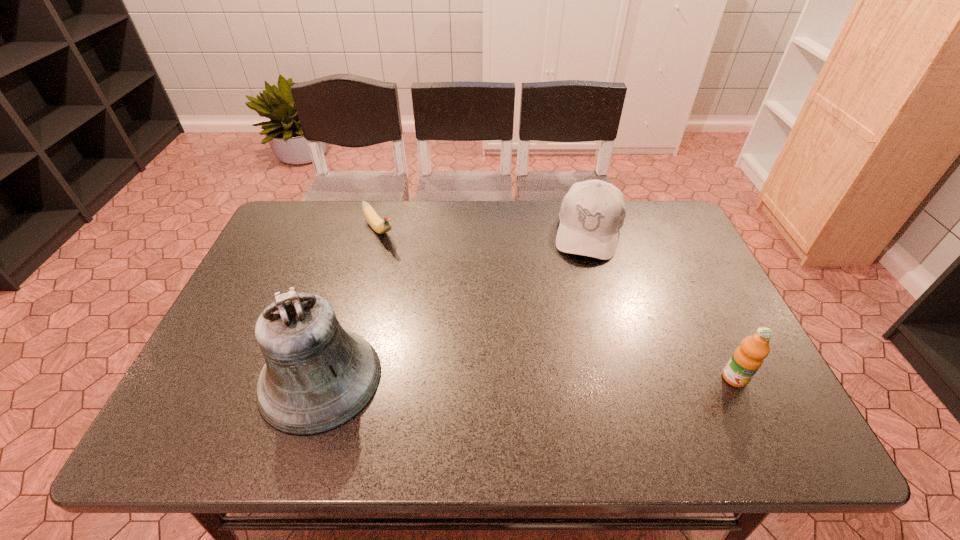
You are a GUI agent. You are given a task and a screenshot of the screen. Output one action in this format:
    pyautogui.click(x=<x>, y=<y>)
    Task: Click on the bell
    
    Given the screenshot: What is the action you would take?
    pyautogui.click(x=318, y=376)

Where is `orange juice`? orange juice is located at coordinates (749, 356).

Find the location of a particular element. banana is located at coordinates (380, 226).

Locate an element on the screen. The width and height of the screenshot is (960, 540). the second object from right to left is located at coordinates (592, 213).

At what (x,y) coordinates should I click in order to perform the action: click on free space located on the back of the tallest object. Please return your answer as a coordinate pair (x, y). Image resolution: width=960 pixels, height=540 pixels. Looking at the image, I should click on (365, 232).

Image resolution: width=960 pixels, height=540 pixels. What are the coordinates of `vacant region located 0.300m at the stem of the banana` in the screenshot? It's located at (437, 304).

This screenshot has width=960, height=540. Find the location of `blank space located 0.310m at the stem of the banana`. blank space located 0.310m at the stem of the banana is located at coordinates (439, 306).

Where is `vacant space located at the stem of the banana`? vacant space located at the stem of the banana is located at coordinates (422, 287).

Find the location of a particular element. The height and width of the screenshot is (540, 960). free space located on the front-facing side of the second object from right to left is located at coordinates (565, 352).

Find the location of a particular element. The width and height of the screenshot is (960, 540). vacant space situated on the front-facing side of the second object from right to left is located at coordinates (573, 319).